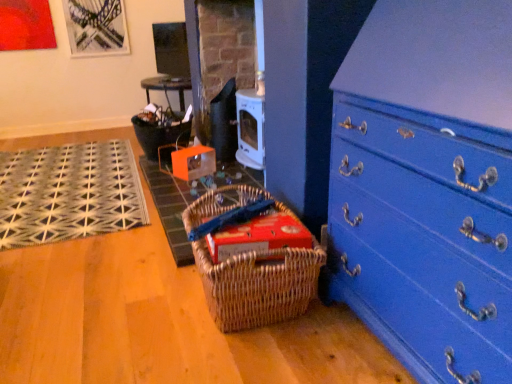
Question: Could you tell me if blue painted wood chest of drawers at lower right is turned towards red cardboard box at center?

Choices:
 (A) yes
 (B) no

Answer: (B)

Question: From the image's perspective, is blue painted wood chest of drawers at lower right above red cardboard box at center?

Choices:
 (A) yes
 (B) no

Answer: (A)

Question: Is blue painted wood chest of drawers at lower right thinner than red cardboard box at center?

Choices:
 (A) no
 (B) yes

Answer: (A)

Question: Is blue painted wood chest of drawers at lower right next to red cardboard box at center and touching it?

Choices:
 (A) yes
 (B) no

Answer: (B)

Question: Is blue painted wood chest of drawers at lower right closer to the viewer compared to red cardboard box at center?

Choices:
 (A) no
 (B) yes

Answer: (B)

Question: Is blue painted wood chest of drawers at lower right oriented away from red cardboard box at center?

Choices:
 (A) yes
 (B) no

Answer: (B)

Question: Is red cardboard box at center shorter than woven brown picnic basket at lower center?

Choices:
 (A) no
 (B) yes

Answer: (B)

Question: From the image's perspective, would you say red cardboard box at center is shown under woven brown picnic basket at lower center?

Choices:
 (A) yes
 (B) no

Answer: (B)

Question: Is red cardboard box at center smaller than woven brown picnic basket at lower center?

Choices:
 (A) no
 (B) yes

Answer: (B)

Question: From the image's perspective, is red cardboard box at center on top of woven brown picnic basket at lower center?

Choices:
 (A) yes
 (B) no

Answer: (A)

Question: Is woven brown picnic basket at lower center at the back of red cardboard box at center?

Choices:
 (A) no
 (B) yes

Answer: (B)

Question: Is red cardboard box at center thinner than woven brown picnic basket at lower center?

Choices:
 (A) no
 (B) yes

Answer: (B)

Question: Are blue painted wood chest of drawers at lower right and woven mat at center, which is counted as the 2th doormat, starting from the left, located far from each other?

Choices:
 (A) yes
 (B) no

Answer: (A)